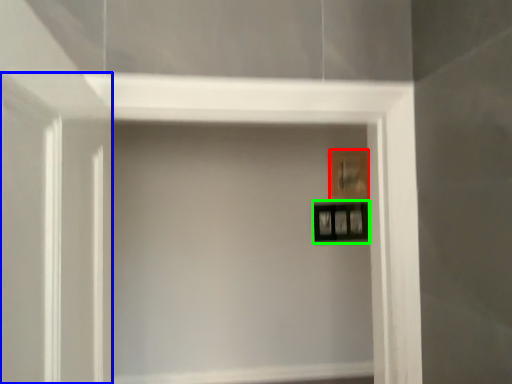
Question: Based on their relative distances, which object is nearer to picture frame (highlighted by a red box)? Choose from glass door (highlighted by a blue box) and picture frame (highlighted by a green box).

Choices:
 (A) glass door
 (B) picture frame

Answer: (B)